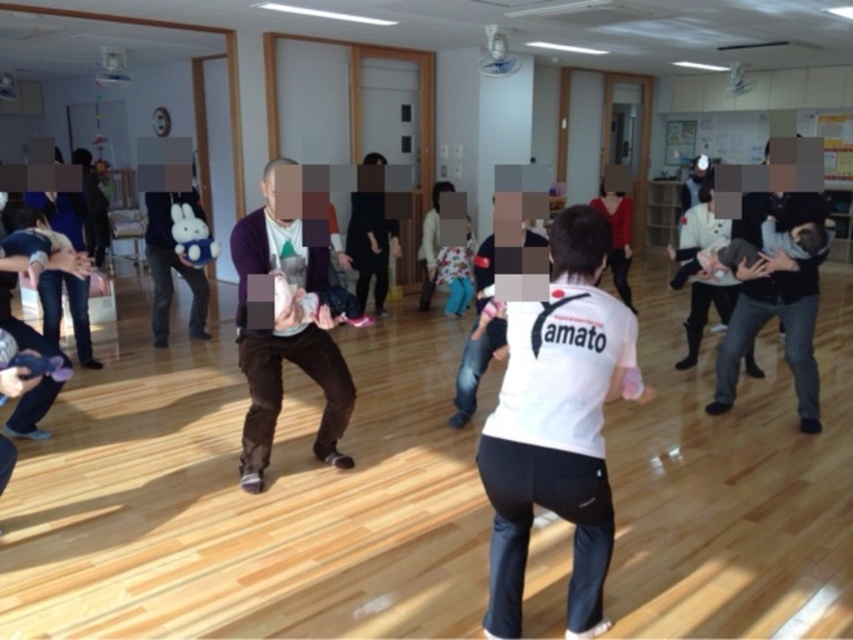
Question: Observing the image, what is the correct spatial positioning of white matte shirt at center in reference to brown cotton sweater at center?

Choices:
 (A) right
 (B) left

Answer: (A)

Question: Does white matte shirt at center come behind brown cotton sweater at center?

Choices:
 (A) no
 (B) yes

Answer: (A)

Question: Which point is farther to the camera?

Choices:
 (A) (260, 468)
 (B) (560, 509)

Answer: (A)

Question: Does white matte shirt at center have a lesser width compared to brown cotton sweater at center?

Choices:
 (A) yes
 (B) no

Answer: (B)

Question: Among these points, which one is nearest to the camera?

Choices:
 (A) (314, 444)
 (B) (515, 493)

Answer: (B)

Question: Which point is closer to the camera taking this photo?

Choices:
 (A) (596, 609)
 (B) (241, 458)

Answer: (A)